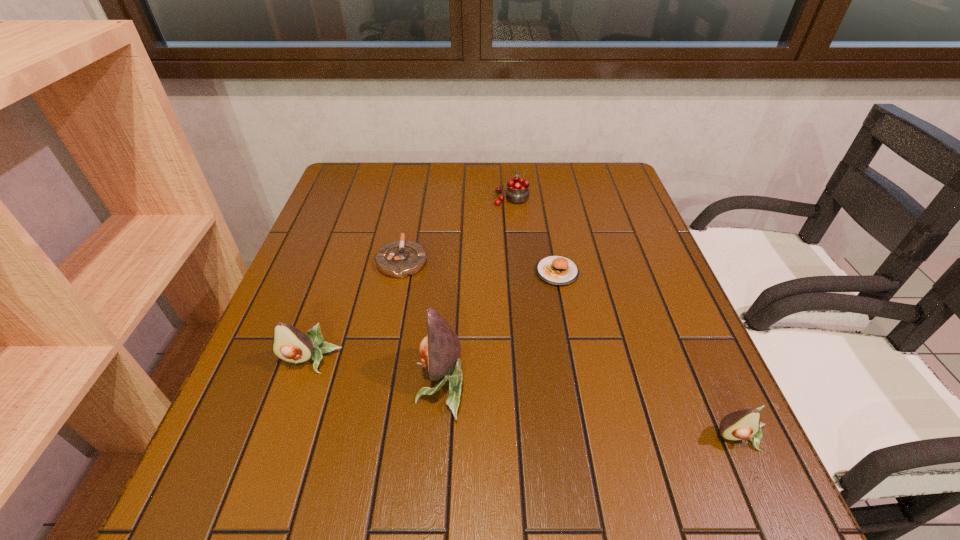
Point out which avocado is positioned as the nearest to the second tallest avocado. Please provide its 2D coordinates. Your answer should be formatted as a tuple, i.e. [(x, y)], where the tuple contains the x and y coordinates of a point satisfying the conditions above.

[(440, 351)]

Locate which avocado ranks second in proximity to the second avocado from left to right. Please provide its 2D coordinates. Your answer should be formatted as a tuple, i.e. [(x, y)], where the tuple contains the x and y coordinates of a point satisfying the conditions above.

[(745, 424)]